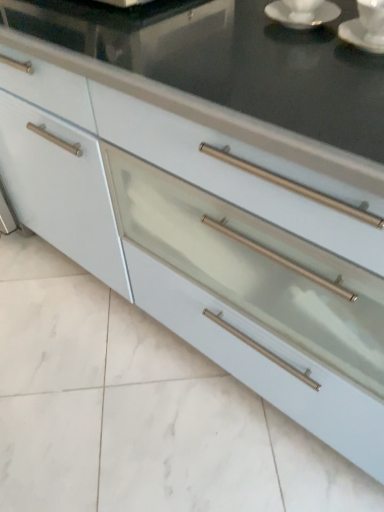
Image resolution: width=384 pixels, height=512 pixels. I want to click on free point in front of white glossy saucer at upper right, so click(299, 55).